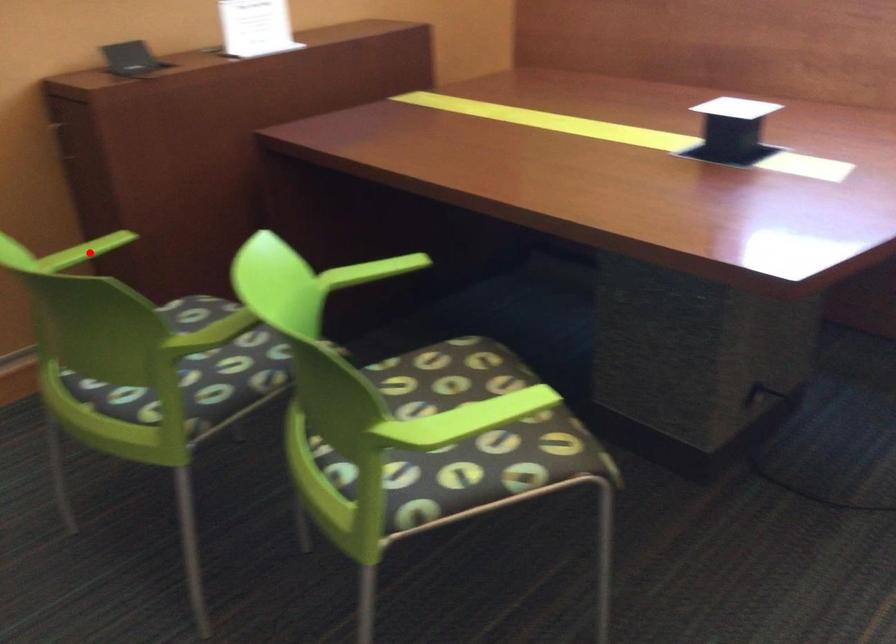
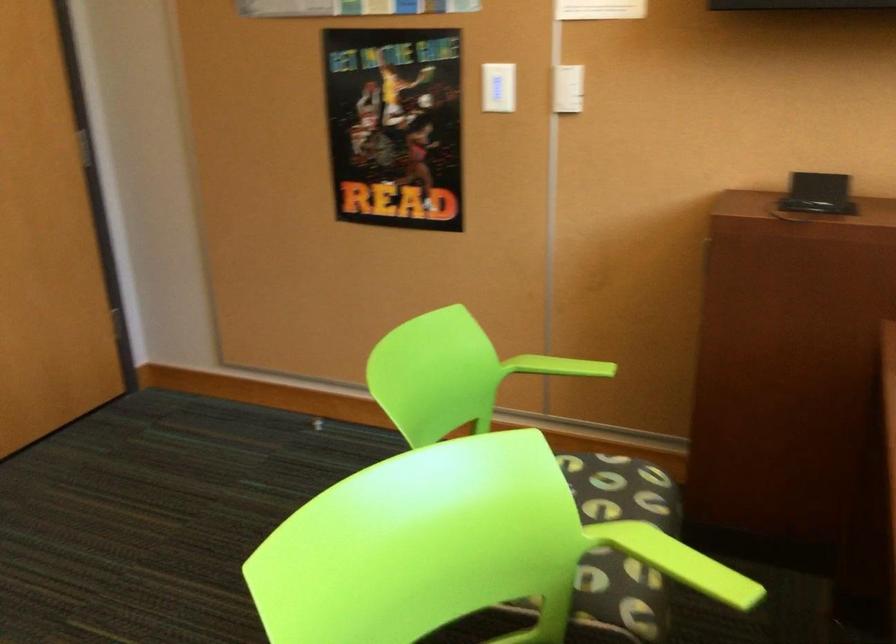
The point at the highlighted location is marked in the first image. Where is the corresponding point in the second image?

(558, 366)